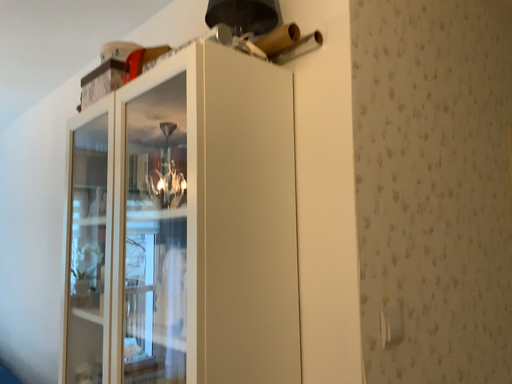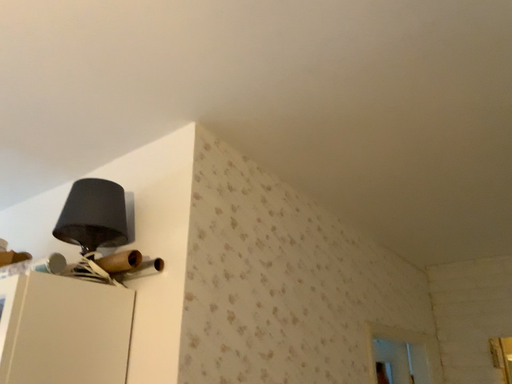
Question: Which way did the camera rotate in the video?

Choices:
 (A) rotated left
 (B) rotated right

Answer: (B)